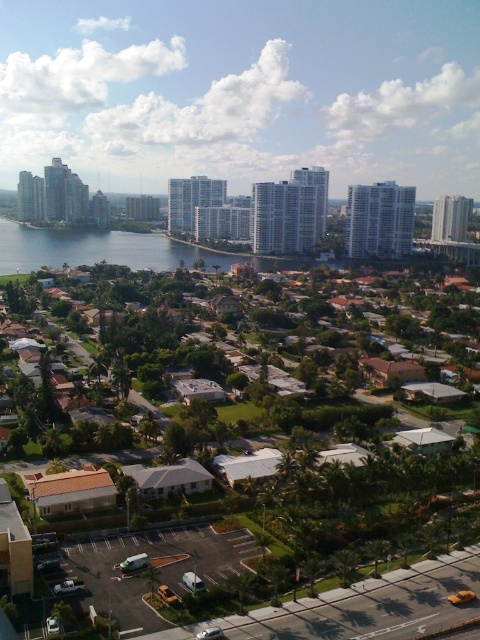
You are planning to build a small garden in the suburban area shown in the image. You have two options for the location based on the green grass at center and the blue water at center. Which location has more space available for the garden?

The blue water at center has a greater width than the green grass at center, so the blue water at center offers more space for the garden.

You are standing at the point labeled point (4, 248) and want to move towards the point labeled point (316, 554). Which direction should you face to walk towards it?

Since point (316, 554) is closer to the viewer than point (4, 248), you should face towards the upper part of the image to walk towards it.